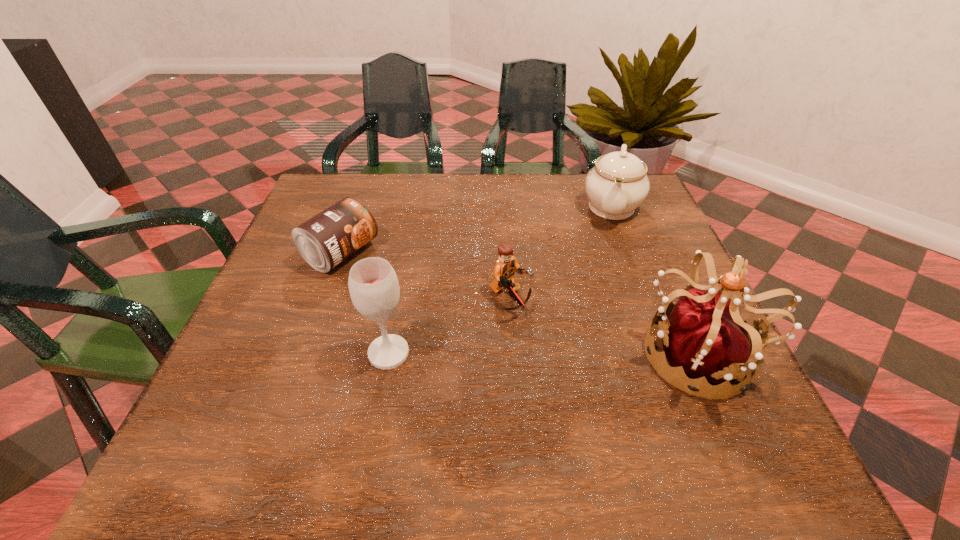
Image resolution: width=960 pixels, height=540 pixels. In order to click on free space located on the front label of the leftmost object in this screenshot , I will do `click(508, 340)`.

Where is `vacant position located on the front label of the leftmost object`? This screenshot has height=540, width=960. vacant position located on the front label of the leftmost object is located at coordinates [x=416, y=292].

You are a GUI agent. You are given a task and a screenshot of the screen. Output one action in this format:
    pyautogui.click(x=<x>, y=<y>)
    Task: Click on the vacant region located holding a crossbow in the hands of the Lego
    This screenshot has width=960, height=540.
    Given the screenshot: What is the action you would take?
    [639, 395]

At what (x,y) coordinates should I click in order to perform the action: click on blank space located holding a crossbow in the hands of the Lego. Please return your answer as a coordinate pair (x, y). The height and width of the screenshot is (540, 960). Looking at the image, I should click on (582, 355).

At what (x,y) coordinates should I click in order to perform the action: click on vacant space situated 0.250m holding a crossbow in the hands of the Lego. Please return your answer as a coordinate pair (x, y). The width and height of the screenshot is (960, 540). Looking at the image, I should click on (635, 392).

Locate an element on the screen. The image size is (960, 540). free space located at the spout of the chinaware is located at coordinates (600, 300).

Find the location of a particular element. The image size is (960, 540). vacant space located 0.230m at the spout of the chinaware is located at coordinates (601, 294).

Locate an element on the screen. The height and width of the screenshot is (540, 960). vacant area situated at the spout of the chinaware is located at coordinates (604, 276).

At what (x,y) coordinates should I click in order to perform the action: click on object at the far edge. Please return your answer as a coordinate pair (x, y). Image resolution: width=960 pixels, height=540 pixels. Looking at the image, I should click on (617, 184).

Identify the location of object positioned at the near edge. This screenshot has width=960, height=540. (704, 336).